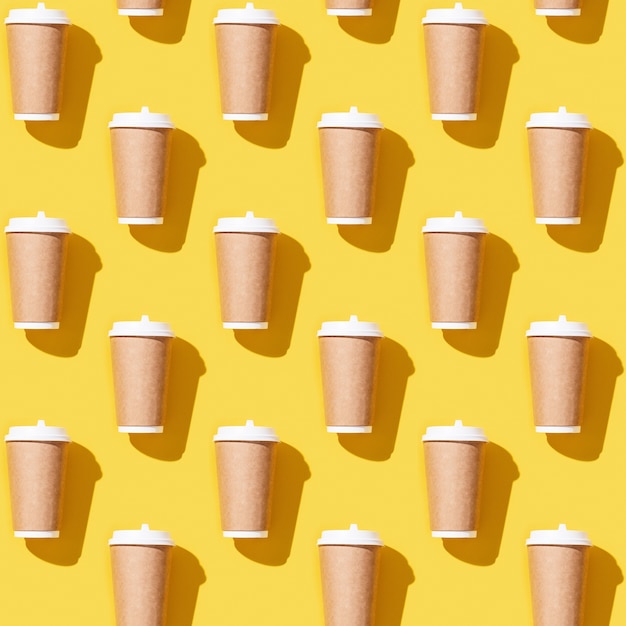
Find the location of a particular element. Image resolution: width=626 pixels, height=626 pixels. cups that aren't fully visible is located at coordinates (146, 4), (349, 4), (562, 1), (145, 567), (337, 583), (560, 581).